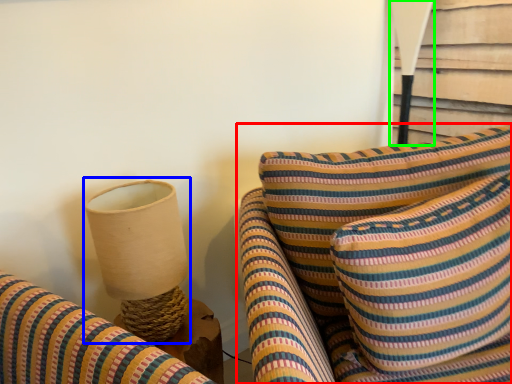
Question: Which is nearer to the furniture (highlighted by a red box)? table lamp (highlighted by a blue box) or table lamp (highlighted by a green box).

Choices:
 (A) table lamp
 (B) table lamp

Answer: (A)